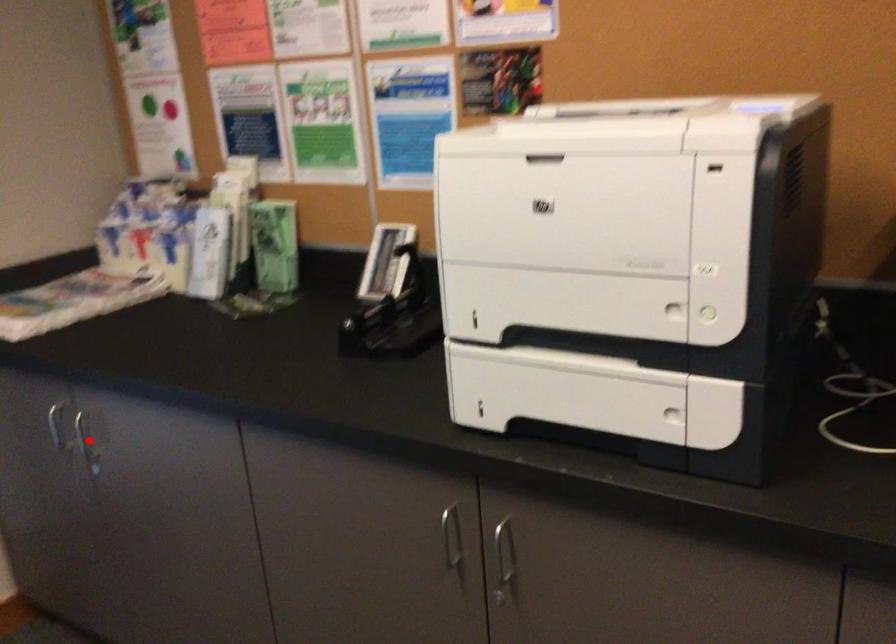
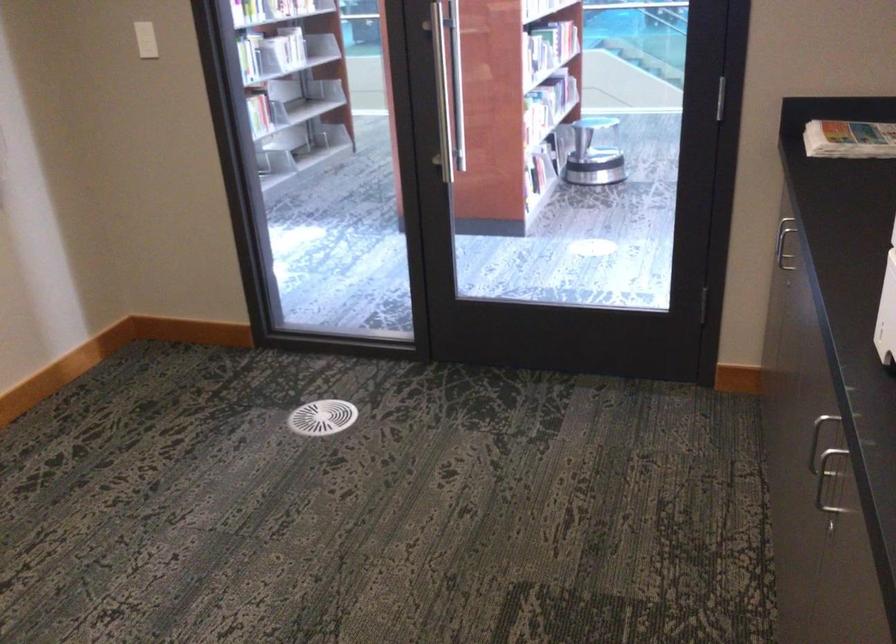
Question: I am providing you with two images of the same scene from different viewpoints. A red point is marked on the first image. Can you still see the location of the red point in image 2?

Choices:
 (A) Yes
 (B) No

Answer: (B)